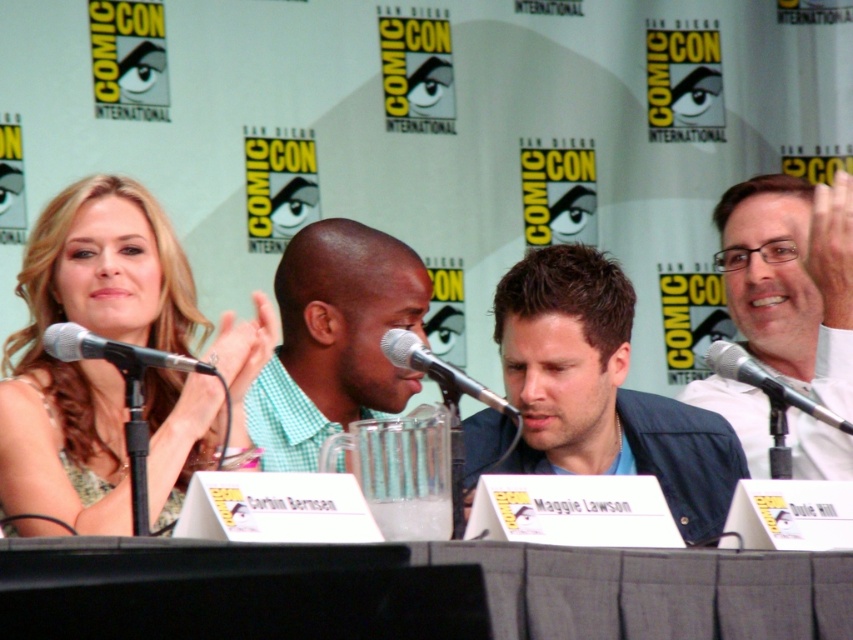
At what (x,y) coordinates should I click in order to perform the action: click on matte gold dress at left. Please return your answer as a coordinate pair (x, y). Looking at the image, I should click on (90, 358).

Is matte gold dress at left above metallic silver microphone at center?

Actually, matte gold dress at left is below metallic silver microphone at center.

This screenshot has height=640, width=853. Find the location of `matte gold dress at left`. matte gold dress at left is located at coordinates pos(90,358).

Image resolution: width=853 pixels, height=640 pixels. Find the location of `matte gold dress at left`. matte gold dress at left is located at coordinates (90, 358).

Can you confirm if dark blue jacket at center is bigger than black metallic microphone at left?

Indeed, dark blue jacket at center has a larger size compared to black metallic microphone at left.

From the picture: Is the position of dark blue jacket at center less distant than that of black metallic microphone at left?

No, it is behind black metallic microphone at left.

Where is `dark blue jacket at center`? This screenshot has height=640, width=853. dark blue jacket at center is located at coordinates (595, 394).

Where is `dark blue jacket at center`? The width and height of the screenshot is (853, 640). dark blue jacket at center is located at coordinates (595, 394).

Does matte gold dress at left appear under green checkered shirt at center?

Yes.

Who is lower down, matte gold dress at left or green checkered shirt at center?

matte gold dress at left is lower down.

Which is in front, point (125, 500) or point (328, 301)?

Point (125, 500) is more forward.

This screenshot has width=853, height=640. Find the location of `matte gold dress at left`. matte gold dress at left is located at coordinates (90, 358).